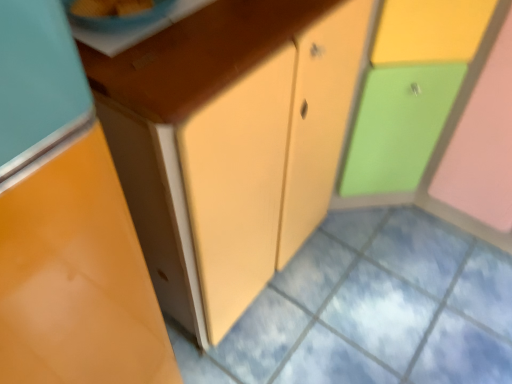
This screenshot has width=512, height=384. What do you see at coordinates (430, 70) in the screenshot?
I see `matte plastic cabinet at right, which is the 2th cabinetry in left-to-right order` at bounding box center [430, 70].

The width and height of the screenshot is (512, 384). Describe the element at coordinates (371, 309) in the screenshot. I see `matte yellow cabinet at center` at that location.

At what (x,y) coordinates should I click in order to perform the action: click on blue glossy bowl at upper left. Please return your answer as a coordinate pair (x, y). The image size is (512, 384). Looking at the image, I should click on (121, 17).

I want to click on matte orange cabinet at left, the first cabinetry viewed from the left, so click(66, 223).

Is blue glossy bowl at upper left to the right of matte plastic cabinet at right, the 1th cabinetry in the right-to-left sequence, from the viewer's perspective?

In fact, blue glossy bowl at upper left is to the left of matte plastic cabinet at right, the 1th cabinetry in the right-to-left sequence.

From a real-world perspective, is blue glossy bowl at upper left positioned above or below matte plastic cabinet at right, the 1th cabinetry in the right-to-left sequence?

In terms of real-world spatial position, blue glossy bowl at upper left is above matte plastic cabinet at right, the 1th cabinetry in the right-to-left sequence.

At what (x,y) coordinates should I click in order to perform the action: click on glass bowl to the left of matte plastic cabinet at right, which is the 2th cabinetry in left-to-right order. Please return your answer as a coordinate pair (x, y). The height and width of the screenshot is (384, 512). Looking at the image, I should click on (121, 17).

Considering the relative sizes of blue glossy bowl at upper left and matte plastic cabinet at right, the 1th cabinetry in the right-to-left sequence, in the image provided, is blue glossy bowl at upper left shorter than matte plastic cabinet at right, the 1th cabinetry in the right-to-left sequence,?

Yes, blue glossy bowl at upper left is shorter than matte plastic cabinet at right, the 1th cabinetry in the right-to-left sequence.

Is point (136, 297) less distant than point (333, 225)?

Yes.

Which object is closer to the camera, matte orange cabinet at left, the first cabinetry viewed from the left, or matte yellow cabinet at center?

matte orange cabinet at left, the first cabinetry viewed from the left, is closer to the camera.

Between matte orange cabinet at left, marked as the 2th cabinetry in a right-to-left arrangement, and matte yellow cabinet at center, which one has smaller size?

Smaller between the two is matte yellow cabinet at center.

Is matte orange cabinet at left, the first cabinetry viewed from the left, in contact with matte yellow cabinet at center?

There is a gap between matte orange cabinet at left, the first cabinetry viewed from the left, and matte yellow cabinet at center.

Is matte orange cabinet at left, marked as the 2th cabinetry in a right-to-left arrangement, next to matte plastic cabinet at right, the 1th cabinetry in the right-to-left sequence, and touching it?

No, matte orange cabinet at left, marked as the 2th cabinetry in a right-to-left arrangement, is not with matte plastic cabinet at right, the 1th cabinetry in the right-to-left sequence.

Looking at this image, is matte orange cabinet at left, marked as the 2th cabinetry in a right-to-left arrangement, completely or partially outside of matte plastic cabinet at right, which is the 2th cabinetry in left-to-right order?

matte orange cabinet at left, marked as the 2th cabinetry in a right-to-left arrangement, is positioned outside matte plastic cabinet at right, which is the 2th cabinetry in left-to-right order.

Is matte orange cabinet at left, the first cabinetry viewed from the left, wider than matte plastic cabinet at right, which is the 2th cabinetry in left-to-right order?

Yes.

Considering the sizes of objects matte orange cabinet at left, marked as the 2th cabinetry in a right-to-left arrangement, and matte plastic cabinet at right, the 1th cabinetry in the right-to-left sequence, in the image provided, who is taller, matte orange cabinet at left, marked as the 2th cabinetry in a right-to-left arrangement, or matte plastic cabinet at right, the 1th cabinetry in the right-to-left sequence,?

matte orange cabinet at left, marked as the 2th cabinetry in a right-to-left arrangement, is taller.

Considering the sizes of objects blue glossy bowl at upper left and matte yellow cabinet at center in the image provided, who is bigger, blue glossy bowl at upper left or matte yellow cabinet at center?

matte yellow cabinet at center.

Could you tell me if blue glossy bowl at upper left is turned towards matte yellow cabinet at center?

No, blue glossy bowl at upper left is not aimed at matte yellow cabinet at center.

From the image's perspective, which is below, blue glossy bowl at upper left or matte yellow cabinet at center?

matte yellow cabinet at center is shown below in the image.

Which point is more distant from viewer, (67, 9) or (53, 80)?

Point (67, 9)

Is blue glossy bowl at upper left bigger or smaller than matte orange cabinet at left, the first cabinetry viewed from the left?

Considering their sizes, blue glossy bowl at upper left takes up less space than matte orange cabinet at left, the first cabinetry viewed from the left.

Which is correct: blue glossy bowl at upper left is inside matte orange cabinet at left, marked as the 2th cabinetry in a right-to-left arrangement, or outside of it?

blue glossy bowl at upper left is not inside matte orange cabinet at left, marked as the 2th cabinetry in a right-to-left arrangement, it's outside.

Considering their positions, is matte yellow cabinet at center located in front of or behind blue glossy bowl at upper left?

In the image, matte yellow cabinet at center appears behind blue glossy bowl at upper left.

Would you say matte yellow cabinet at center is a long distance from blue glossy bowl at upper left?

Yes, matte yellow cabinet at center and blue glossy bowl at upper left are located far from each other.

Considering the positions of point (474, 262) and point (109, 26), is point (474, 262) closer or farther from the camera than point (109, 26)?

Point (474, 262) is positioned farther from the camera compared to point (109, 26).

Does matte yellow cabinet at center turn towards blue glossy bowl at upper left?

No, matte yellow cabinet at center does not turn towards blue glossy bowl at upper left.

Are matte plastic cabinet at right, which is the 2th cabinetry in left-to-right order, and blue glossy bowl at upper left far apart?

No.

Between matte plastic cabinet at right, which is the 2th cabinetry in left-to-right order, and blue glossy bowl at upper left, which one has larger width?

With larger width is matte plastic cabinet at right, which is the 2th cabinetry in left-to-right order.

Is point (382, 79) farther from viewer compared to point (80, 19)?

Yes, point (382, 79) is behind point (80, 19).

You are a GUI agent. You are given a task and a screenshot of the screen. Output one action in this format:
    pyautogui.click(x=<x>, y=<y>)
    Task: Click on the cabinetry that appears on the right of blue glossy bowl at upper left
    The image size is (512, 384).
    Given the screenshot: What is the action you would take?
    pyautogui.click(x=430, y=70)

From a real-world perspective, which cabinetry is the 2nd one above the matte yellow cabinet at center? Please provide its 2D coordinates.

[(66, 223)]

Looking at the image, which one is located closer to matte yellow cabinet at center, matte plastic cabinet at right, which is the 2th cabinetry in left-to-right order, or blue glossy bowl at upper left?

The object closer to matte yellow cabinet at center is matte plastic cabinet at right, which is the 2th cabinetry in left-to-right order.

When comparing their distances from matte orange cabinet at left, marked as the 2th cabinetry in a right-to-left arrangement, does matte plastic cabinet at right, the 1th cabinetry in the right-to-left sequence, or matte yellow cabinet at center seem closer?

The object closer to matte orange cabinet at left, marked as the 2th cabinetry in a right-to-left arrangement, is matte yellow cabinet at center.

Looking at the image, which one is located further to matte plastic cabinet at right, the 1th cabinetry in the right-to-left sequence, matte yellow cabinet at center or blue glossy bowl at upper left?

blue glossy bowl at upper left.

Based on their spatial positions, is matte orange cabinet at left, marked as the 2th cabinetry in a right-to-left arrangement, or matte yellow cabinet at center closer to blue glossy bowl at upper left?

Based on the image, matte orange cabinet at left, marked as the 2th cabinetry in a right-to-left arrangement, appears to be nearer to blue glossy bowl at upper left.

Based on their spatial positions, is matte orange cabinet at left, the first cabinetry viewed from the left, or matte plastic cabinet at right, the 1th cabinetry in the right-to-left sequence, further from matte yellow cabinet at center?

matte orange cabinet at left, the first cabinetry viewed from the left, is further to matte yellow cabinet at center.

When comparing their distances from matte orange cabinet at left, the first cabinetry viewed from the left, does blue glossy bowl at upper left or matte yellow cabinet at center seem closer?

The object closer to matte orange cabinet at left, the first cabinetry viewed from the left, is blue glossy bowl at upper left.

From the image, which object appears to be farther from blue glossy bowl at upper left, matte plastic cabinet at right, the 1th cabinetry in the right-to-left sequence, or matte orange cabinet at left, marked as the 2th cabinetry in a right-to-left arrangement?

matte plastic cabinet at right, the 1th cabinetry in the right-to-left sequence, is positioned further to the anchor blue glossy bowl at upper left.

Based on their spatial positions, is matte orange cabinet at left, marked as the 2th cabinetry in a right-to-left arrangement, or blue glossy bowl at upper left further from matte plastic cabinet at right, the 1th cabinetry in the right-to-left sequence?

matte orange cabinet at left, marked as the 2th cabinetry in a right-to-left arrangement, is positioned further to the anchor matte plastic cabinet at right, the 1th cabinetry in the right-to-left sequence.

Find the location of a particular element. The height and width of the screenshot is (384, 512). glass bowl located between matte orange cabinet at left, the first cabinetry viewed from the left, and matte plastic cabinet at right, which is the 2th cabinetry in left-to-right order, in the left-right direction is located at coordinates (121, 17).

The height and width of the screenshot is (384, 512). What are the coordinates of `glass bowl located between matte orange cabinet at left, marked as the 2th cabinetry in a right-to-left arrangement, and matte yellow cabinet at center in the left-right direction` in the screenshot? It's located at (121, 17).

Where is `square between matte orange cabinet at left, marked as the 2th cabinetry in a right-to-left arrangement, and matte plastic cabinet at right, which is the 2th cabinetry in left-to-right order, from left to right`? square between matte orange cabinet at left, marked as the 2th cabinetry in a right-to-left arrangement, and matte plastic cabinet at right, which is the 2th cabinetry in left-to-right order, from left to right is located at coordinates (371, 309).